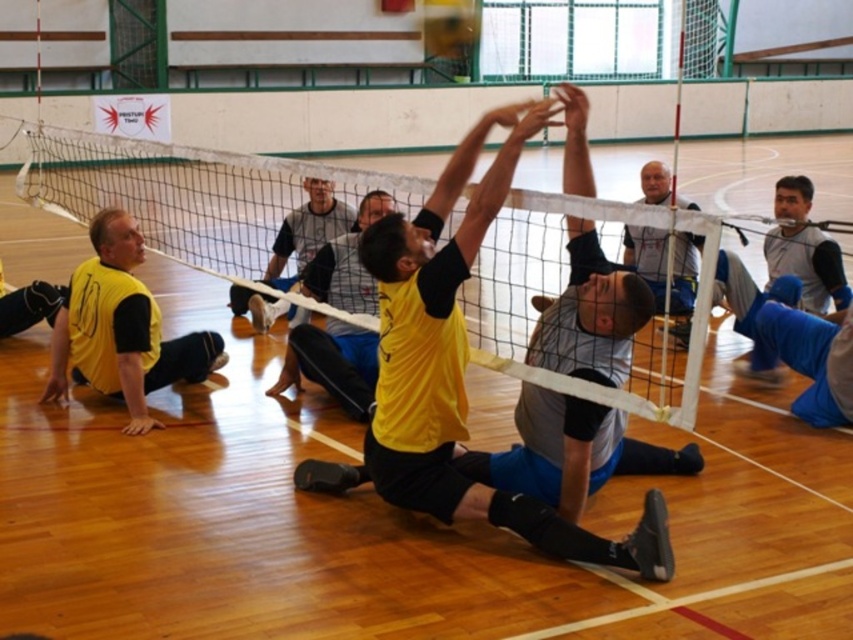
Is yellow matte/vinyl squat at center closer to the viewer compared to white mesh net at upper center?

Yes.

Who is positioned more to the right, yellow matte/vinyl squat at center or white mesh net at upper center?

white mesh net at upper center

The width and height of the screenshot is (853, 640). I want to click on yellow matte/vinyl squat at center, so click(x=457, y=372).

You are a GUI agent. You are given a task and a screenshot of the screen. Output one action in this format:
    pyautogui.click(x=<x>, y=<y>)
    Task: Click on the yellow matte/vinyl squat at center
    
    Given the screenshot: What is the action you would take?
    pyautogui.click(x=457, y=372)

Who is positioned more to the right, white mesh net at center or matte black shorts at upper center?

matte black shorts at upper center is more to the right.

How much distance is there between white mesh net at center and matte black shorts at upper center?

white mesh net at center and matte black shorts at upper center are 7.93 feet apart from each other.

Is point (669, 416) behind point (280, 244)?

No.

Identify the location of white mesh net at center. (184, 195).

Which is in front, point (260, 209) or point (791, 198)?

Point (791, 198)

The height and width of the screenshot is (640, 853). What are the coordinates of `white mesh net at center` in the screenshot? It's located at (184, 195).

Where is `white mesh net at center`? This screenshot has height=640, width=853. white mesh net at center is located at coordinates (184, 195).